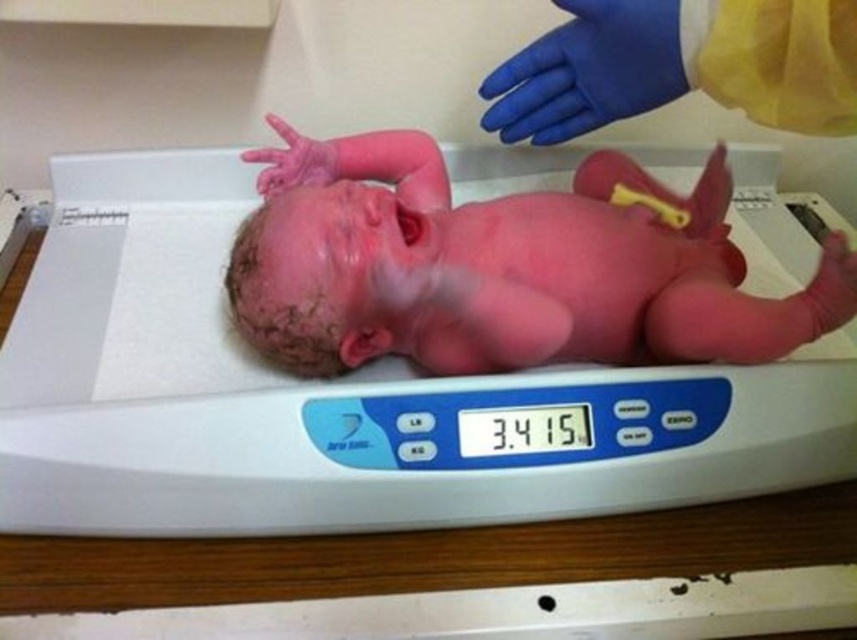
Between point (466, 353) and point (276, 125), which one is positioned behind?

The point (276, 125) is behind.

Does pink rubber newborn at center appear over rubber glove at upper center?

No, pink rubber newborn at center is not above rubber glove at upper center.

Describe the element at coordinates (500, 268) in the screenshot. I see `pink rubber newborn at center` at that location.

I want to click on pink rubber newborn at center, so pyautogui.click(x=500, y=268).

This screenshot has width=857, height=640. Find the location of `white plastic scale at center`. white plastic scale at center is located at coordinates (340, 397).

Consider the image. Is white plastic scale at center smaller than rubber glove at upper center?

No.

Locate an element on the screen. The width and height of the screenshot is (857, 640). white plastic scale at center is located at coordinates (340, 397).

This screenshot has width=857, height=640. In order to click on white plastic scale at center in this screenshot , I will do `click(340, 397)`.

Is point (165, 404) less distant than point (676, 272)?

Yes, it is.

How far apart are white plastic scale at center and pink rubber newborn at center?

white plastic scale at center is 10.79 centimeters away from pink rubber newborn at center.

Does point (240, 454) come farther from viewer compared to point (393, 150)?

No, (240, 454) is in front of (393, 150).

Find the location of a particular element. This screenshot has width=857, height=640. white plastic scale at center is located at coordinates (340, 397).